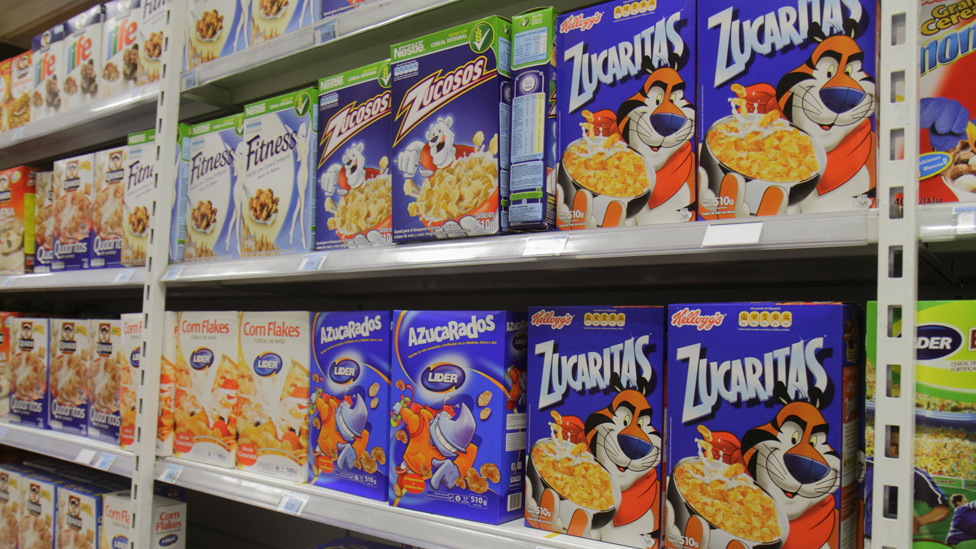
Locate an element on the screen. This screenshot has width=976, height=549. cereal boxes with a mascot on the front is located at coordinates (354, 171), (437, 145), (441, 421), (350, 436), (615, 436), (790, 469), (820, 74), (666, 121).